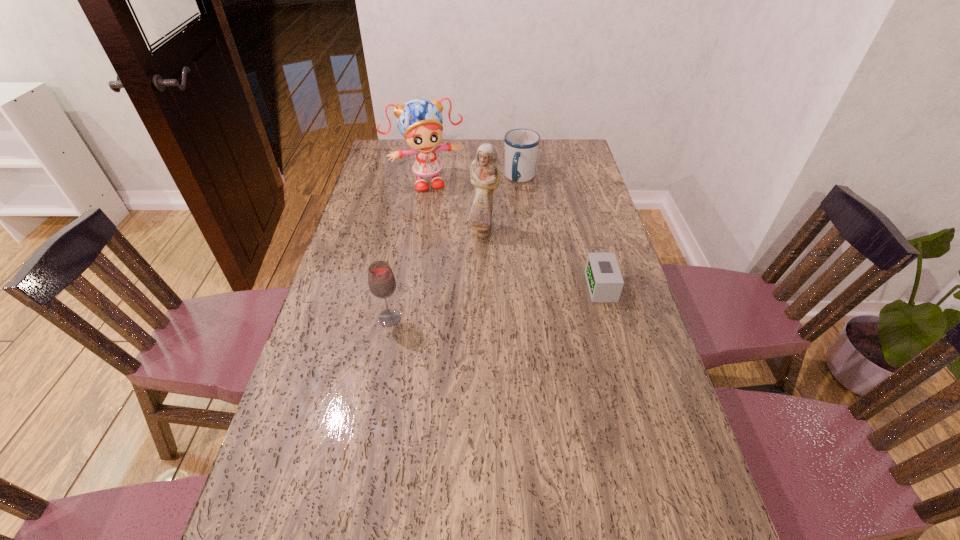
You are a GUI agent. You are given a task and a screenshot of the screen. Output one action in this format:
    pyautogui.click(x=<x>, y=<y>)
    Task: Click on the vacant space situated on the front-facing side of the alarm clock
    This screenshot has width=960, height=540.
    Given the screenshot: What is the action you would take?
    pyautogui.click(x=477, y=287)

Identify the location of vacant space located 0.180m on the front-facing side of the alarm clock. Image resolution: width=960 pixels, height=540 pixels. click(x=527, y=287).

Identify the location of vacant area situated on the face of the doll. (457, 247).

The height and width of the screenshot is (540, 960). I want to click on vacant space positioned 0.050m on the face of the doll, so click(x=438, y=200).

Locate an element on the screen. blank area located on the face of the doll is located at coordinates (455, 244).

Image resolution: width=960 pixels, height=540 pixels. I want to click on vacant space positioned 0.120m on the handle side of the fourth tallest object, so click(514, 209).

Find the location of `vacant space located 0.360m on the handle side of the fourth tallest object`. vacant space located 0.360m on the handle side of the fourth tallest object is located at coordinates (503, 251).

At what (x,y) coordinates should I click in order to perform the action: click on free region located on the handle side of the fourth tallest object. Please return your answer as a coordinate pair (x, y). This screenshot has width=960, height=540. Looking at the image, I should click on (505, 245).

Where is `vacant space located on the front-facing side of the figurine`? The width and height of the screenshot is (960, 540). vacant space located on the front-facing side of the figurine is located at coordinates (503, 274).

Locate an element on the screen. This screenshot has height=540, width=960. vacant area situated 0.140m on the front-facing side of the figurine is located at coordinates coord(501,269).